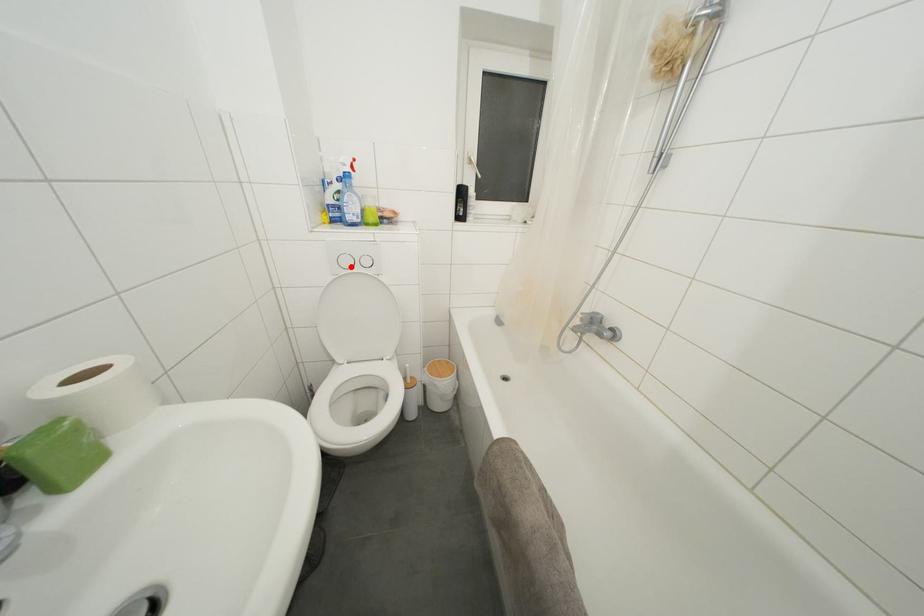
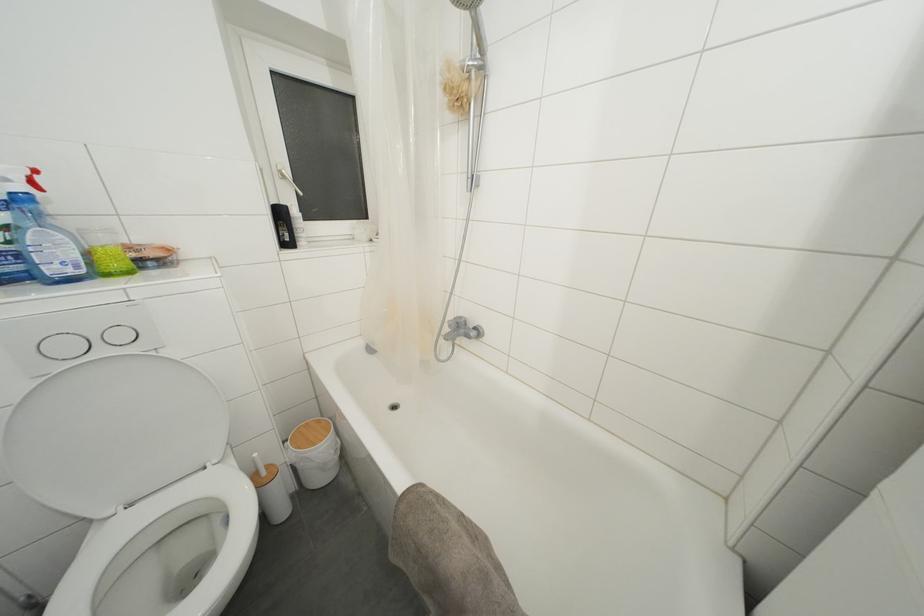
Question: A red point is marked in image1. In image2, is the corresponding 3D point closer to the camera or farther? Reply with the corresponding letter.

Choices:
 (A) The corresponding 3D point is closer.
 (B) The corresponding 3D point is farther.

Answer: (B)